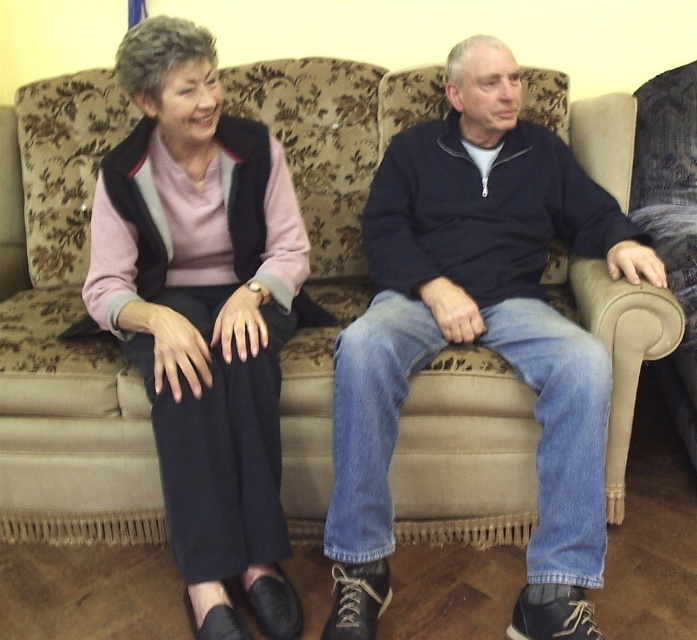
You are a tailor measuring the width of the denim jeans at center and the matte black pants at left for a customer. Which pair of pants has a wider leg opening?

The denim jeans at center has a wider leg opening than the matte black pants at left because the denim jeans at center is wider.

You are an interior designer analyzing the placement of furniture in this living room. The sofa is positioned along the wall. If you want to place a small table next to the denim jeans at center, where should you place it relative to the sofa?

The denim jeans at center is located at coordinates point [477,333], so placing a small table next to the denim jeans at center would require positioning it near that coordinate relative to the sofa.